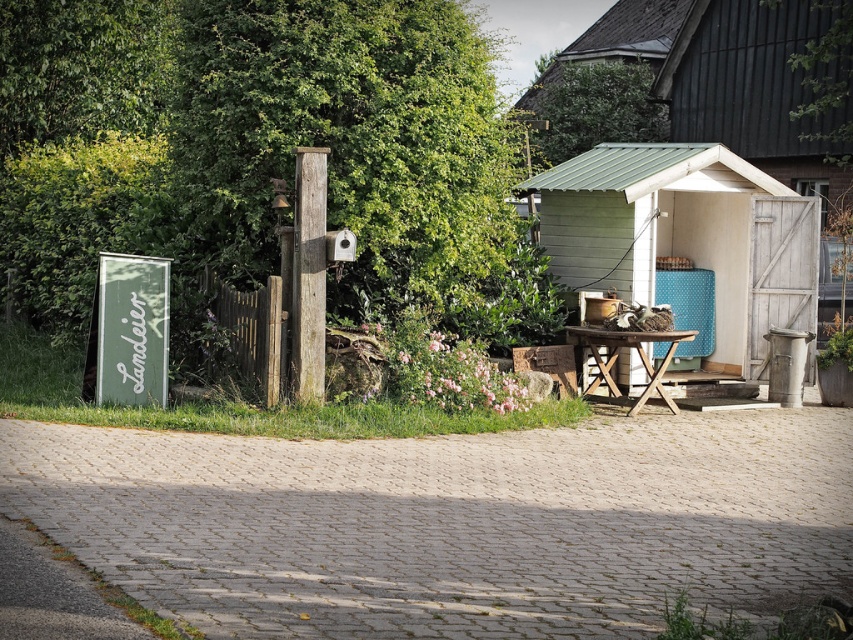
Question: Does green leafy tree at upper center appear over wooden post at center?

Choices:
 (A) no
 (B) yes

Answer: (B)

Question: Is green leafy tree at upper left below weathered wood post at center?

Choices:
 (A) no
 (B) yes

Answer: (A)

Question: Which point is farther to the camera?

Choices:
 (A) (631, 136)
 (B) (537, 234)
 (C) (190, 220)
 (D) (316, 230)

Answer: (A)

Question: Which of the following is the closest to the observer?

Choices:
 (A) green leafy tree at upper left
 (B) white wood shed at center
 (C) weathered wood post at center

Answer: (C)

Question: Is green leafy tree at upper left further to the viewer compared to green leafy tree at upper center?

Choices:
 (A) yes
 (B) no

Answer: (B)

Question: Which object is the closest to the wooden post at center?

Choices:
 (A) white wood shed at center
 (B) weathered wood post at center
 (C) green leafy tree at upper left
 (D) green leafy tree at upper center

Answer: (A)